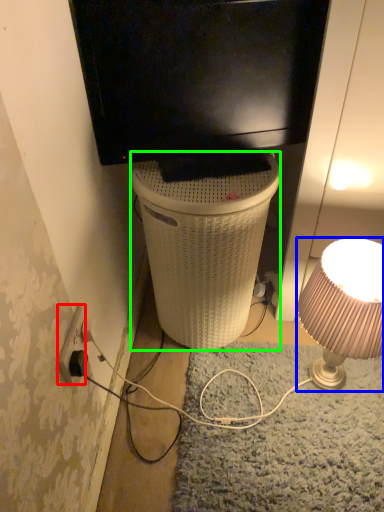
Question: Based on their relative distances, which object is farther from power outlet (highlighted by a red box)? Choose from lamp (highlighted by a blue box) and trash bin/can (highlighted by a green box).

Choices:
 (A) lamp
 (B) trash bin/can

Answer: (A)